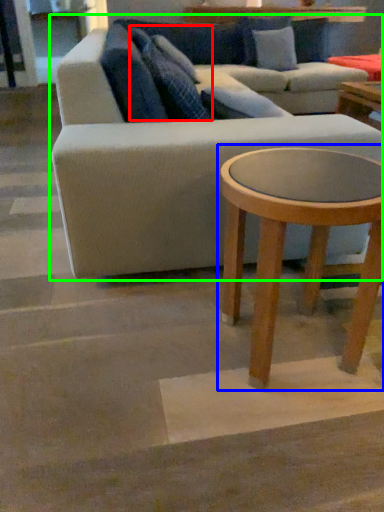
Question: Based on their relative distances, which object is nearer to pillow (highlighted by a red box)? Choose from coffee table (highlighted by a blue box) and studio couch (highlighted by a green box).

Choices:
 (A) coffee table
 (B) studio couch

Answer: (B)